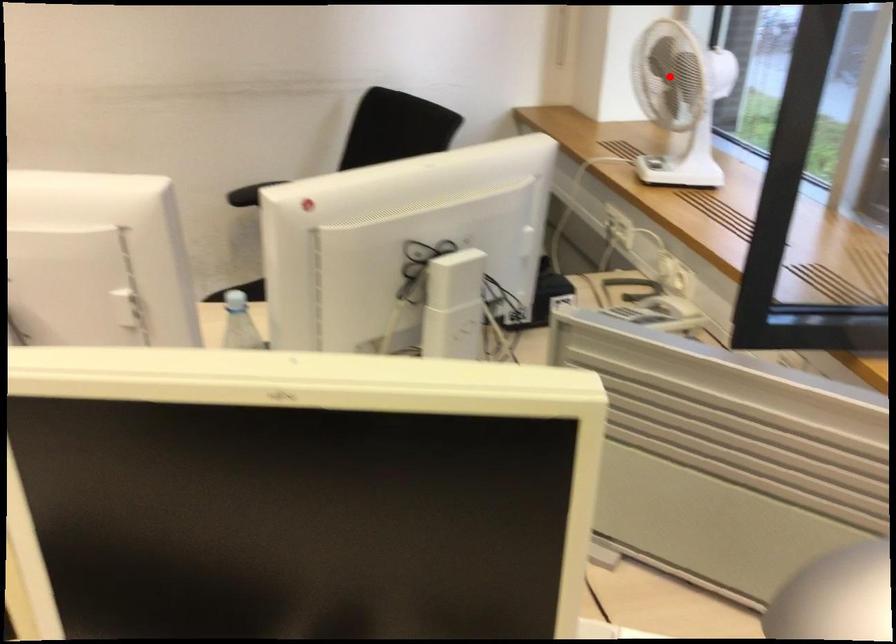
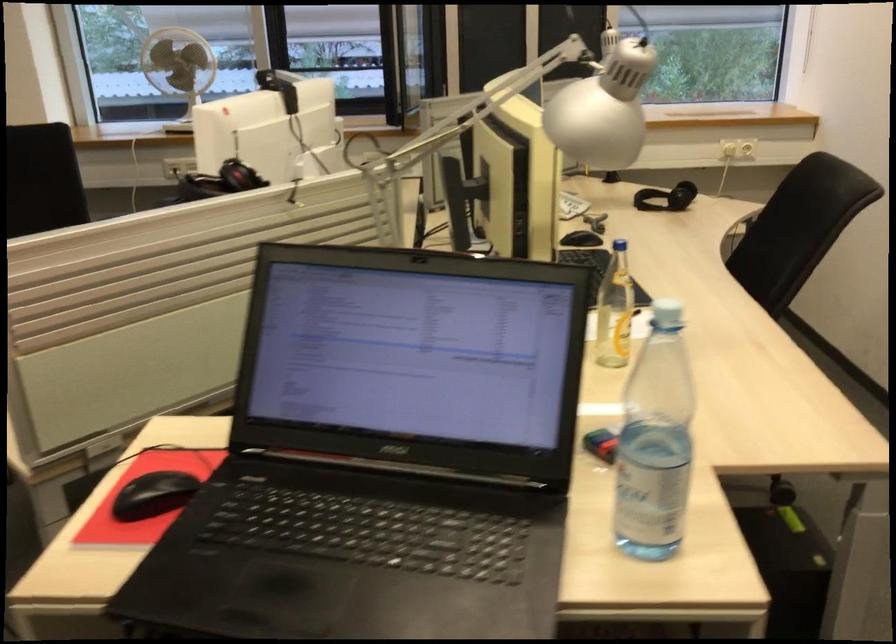
Find the pixel in the second image that matches the highlighted location in the first image.

(177, 67)